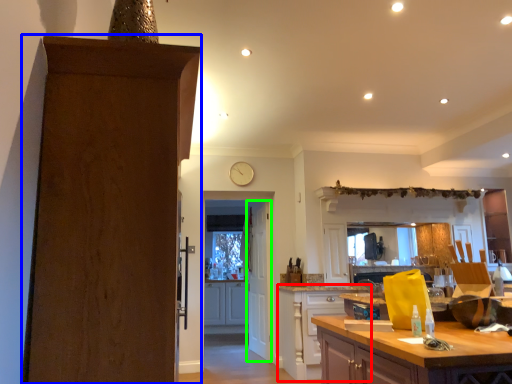
Question: Based on their relative distances, which object is nearer to cabinetry (highlighted by a red box)? Choose from door (highlighted by a blue box) and door (highlighted by a green box).

Choices:
 (A) door
 (B) door

Answer: (B)